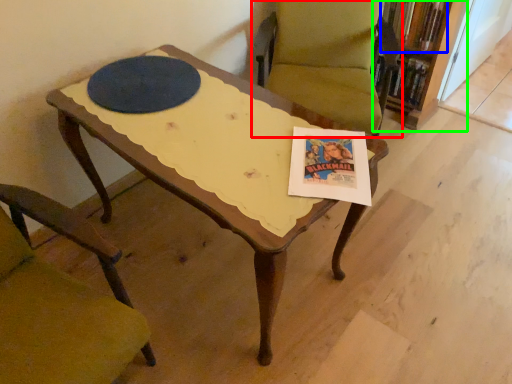
Question: Considering the real-world distances, which object is farthest from chair (highlighted by a red box)? book (highlighted by a blue box) or bookcase (highlighted by a green box)?

Choices:
 (A) book
 (B) bookcase

Answer: (A)